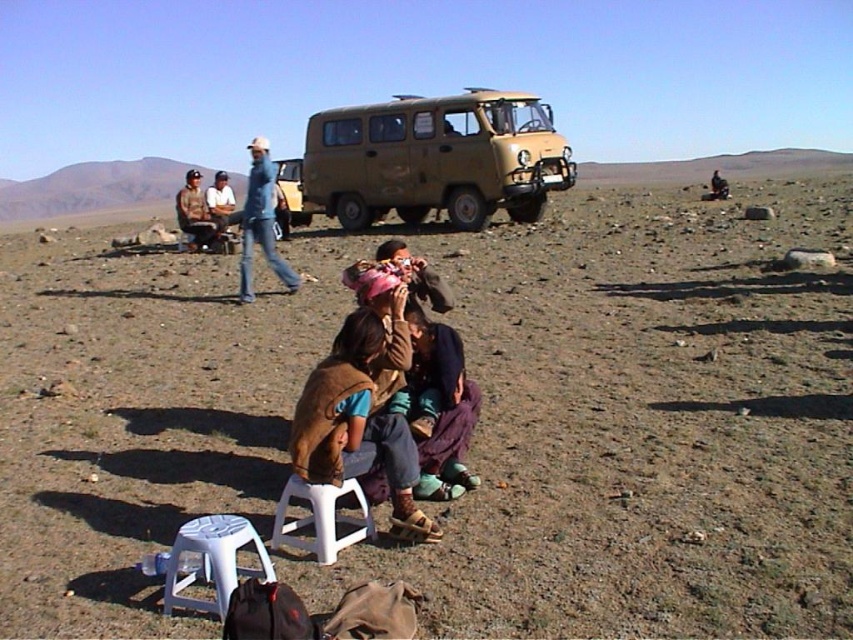
Between camouflage fabric van at center and jeans at center, which one has more height?

With more height is camouflage fabric van at center.

What do you see at coordinates (434, 157) in the screenshot?
I see `camouflage fabric van at center` at bounding box center [434, 157].

Is point (466, 202) behind point (289, 291)?

Yes, point (466, 202) is farther from viewer.

Locate an element on the screen. The image size is (853, 640). camouflage fabric van at center is located at coordinates (434, 157).

Can you confirm if camouflage fabric van at center is positioned to the left of white plastic stool at center?

In fact, camouflage fabric van at center is to the right of white plastic stool at center.

Who is lower down, camouflage fabric van at center or white plastic stool at center?

white plastic stool at center is lower down.

I want to click on camouflage fabric van at center, so coord(434,157).

Locate an element on the screen. camouflage fabric van at center is located at coordinates (434, 157).

Does jeans at center have a lesser height compared to brown leather jacket at center?

Yes.

Does jeans at center lie in front of brown leather jacket at center?

Yes.

I want to click on jeans at center, so click(260, 221).

What are the coordinates of `jeans at center` in the screenshot? It's located at (260, 221).